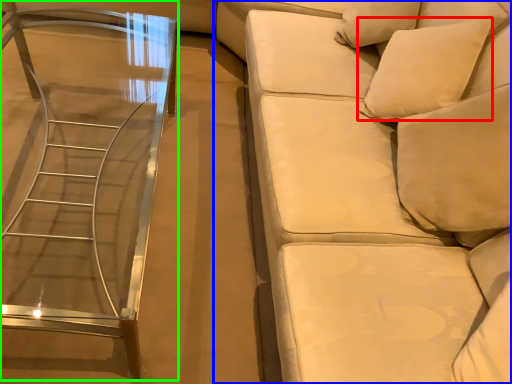
Question: Considering the real-world distances, which object is farthest from pillow (highlighted by a red box)? studio couch (highlighted by a blue box) or table (highlighted by a green box)?

Choices:
 (A) studio couch
 (B) table

Answer: (B)